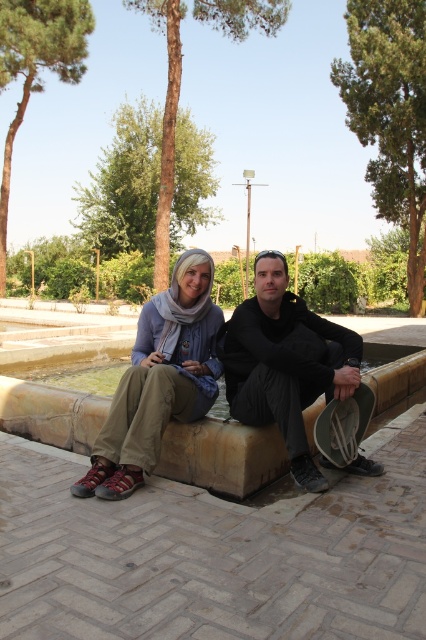
Does matte black clothing at center lie behind brown stone curb at center?

No, matte black clothing at center is closer to the viewer.

Can you confirm if matte black clothing at center is thinner than brown stone curb at center?

No, matte black clothing at center is not thinner than brown stone curb at center.

Where is `matte black clothing at center`? This screenshot has width=426, height=640. matte black clothing at center is located at coordinates (221, 372).

The width and height of the screenshot is (426, 640). I want to click on matte black clothing at center, so click(x=221, y=372).

Between matte black clothing at center and black matte hat at center, which one is positioned lower?

matte black clothing at center is lower down.

Does point (115, 413) come in front of point (264, 413)?

That is True.

Where is `matte black clothing at center`? This screenshot has width=426, height=640. matte black clothing at center is located at coordinates (221, 372).

This screenshot has height=640, width=426. Find the location of `matte black clothing at center`. matte black clothing at center is located at coordinates (221, 372).

Describe the element at coordinates (284, 362) in the screenshot. I see `black matte hat at center` at that location.

Which of these two, black matte hat at center or matte blue scarf at center, stands taller?

black matte hat at center is taller.

What are the coordinates of `black matte hat at center` in the screenshot? It's located at (284, 362).